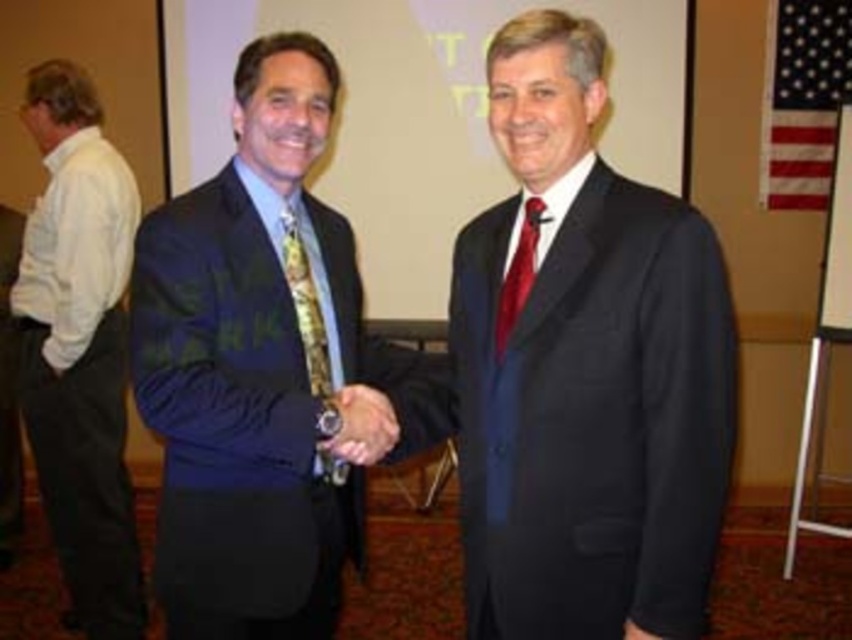
Is point (325, 472) in front of point (383, 451)?

No.

Can you confirm if gold metallic tie at center is positioned to the right of matte gold watch at center?

Incorrect, gold metallic tie at center is not on the right side of matte gold watch at center.

Locate an element on the screen. This screenshot has height=640, width=852. gold metallic tie at center is located at coordinates (306, 305).

Identify the location of gold metallic tie at center. Image resolution: width=852 pixels, height=640 pixels. (306, 305).

Does point (537, 237) lie behind point (629, 628)?

Yes, point (537, 237) is farther from viewer.

Locate an element on the screen. The image size is (852, 640). red satin tie at center is located at coordinates (517, 275).

Measure the distance between red satin tie at center and camera.

A distance of 1.61 meters exists between red satin tie at center and camera.

You are a GUI agent. You are given a task and a screenshot of the screen. Output one action in this format:
    pyautogui.click(x=<x>, y=<y>)
    Task: Click on the red satin tie at center
    Image resolution: width=852 pixels, height=640 pixels.
    Given the screenshot: What is the action you would take?
    pyautogui.click(x=517, y=275)

Is matte black suit at left smaller than black leather hand at center?

No.

Can you confirm if matte black suit at left is positioned to the right of black leather hand at center?

In fact, matte black suit at left is to the left of black leather hand at center.

Which is in front, point (4, 525) or point (637, 627)?

Point (637, 627) is in front.

You are a GUI agent. You are given a task and a screenshot of the screen. Output one action in this format:
    pyautogui.click(x=<x>, y=<y>)
    Task: Click on the matte black suit at left
    
    Given the screenshot: What is the action you would take?
    pyautogui.click(x=9, y=390)